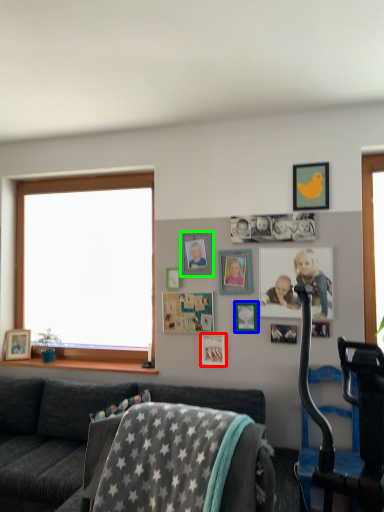
Question: Considering the real-world distances, which object is closest to picture frame (highlighted by a red box)? picture frame (highlighted by a blue box) or picture frame (highlighted by a green box).

Choices:
 (A) picture frame
 (B) picture frame

Answer: (A)